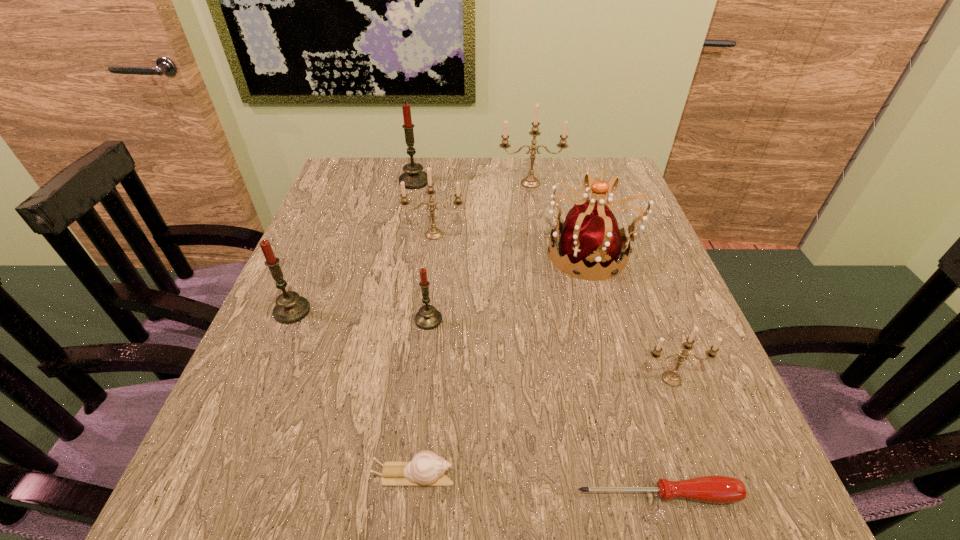
Image resolution: width=960 pixels, height=540 pixels. What are the coordinates of `the smallest metallic candle` in the screenshot? It's located at (672, 378).

Find the location of `the rightmost metallic candle`. the rightmost metallic candle is located at coordinates (672, 378).

This screenshot has width=960, height=540. I want to click on escargot, so click(426, 468).

You are a GUI agent. You are given a task and a screenshot of the screen. Output one action in this format:
    pyautogui.click(x=<x>, y=<y>)
    Task: Click on the red screwdriver
    Image resolution: width=960 pixels, height=540 pixels.
    Given the screenshot: What is the action you would take?
    pyautogui.click(x=716, y=489)

What are the coordinates of `the shortest object` in the screenshot? It's located at (716, 489).

At what (x,y) coordinates should I click in order to perform the action: click on free space located on the right of the biggest red candle. Please return your answer as a coordinate pair (x, y). Image resolution: width=960 pixels, height=540 pixels. Looking at the image, I should click on (476, 181).

At what (x,y) coordinates should I click in order to perform the action: click on vacant space located 0.250m on the front of the second metallic candle from right to left. Please return your answer as a coordinate pair (x, y). The height and width of the screenshot is (540, 960). Looking at the image, I should click on (540, 246).

Identify the location of free space located 0.210m on the front-facing side of the red tiara. (452, 254).

Locate an element on the screen. The image size is (960, 540). vacant space situated on the front-facing side of the red tiara is located at coordinates (492, 254).

This screenshot has width=960, height=540. I want to click on vacant area situated on the front-facing side of the red tiara, so click(x=457, y=254).